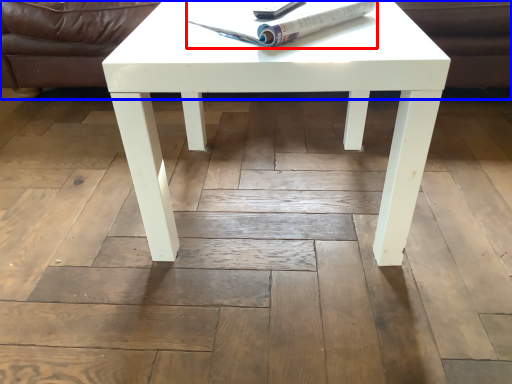
Question: Which point is closer to the camera, magazine (highlighted by a red box) or couch (highlighted by a blue box)?

Choices:
 (A) magazine
 (B) couch

Answer: (A)